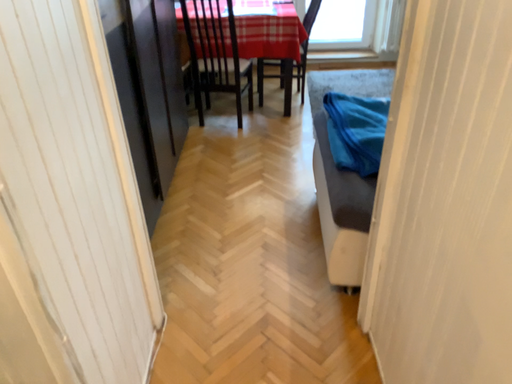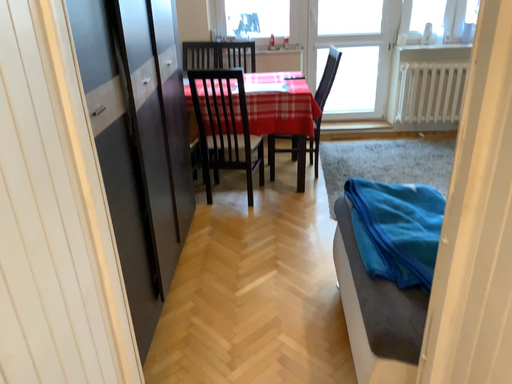
Question: How did the camera likely rotate when shooting the video?

Choices:
 (A) rotated upward
 (B) rotated downward

Answer: (A)